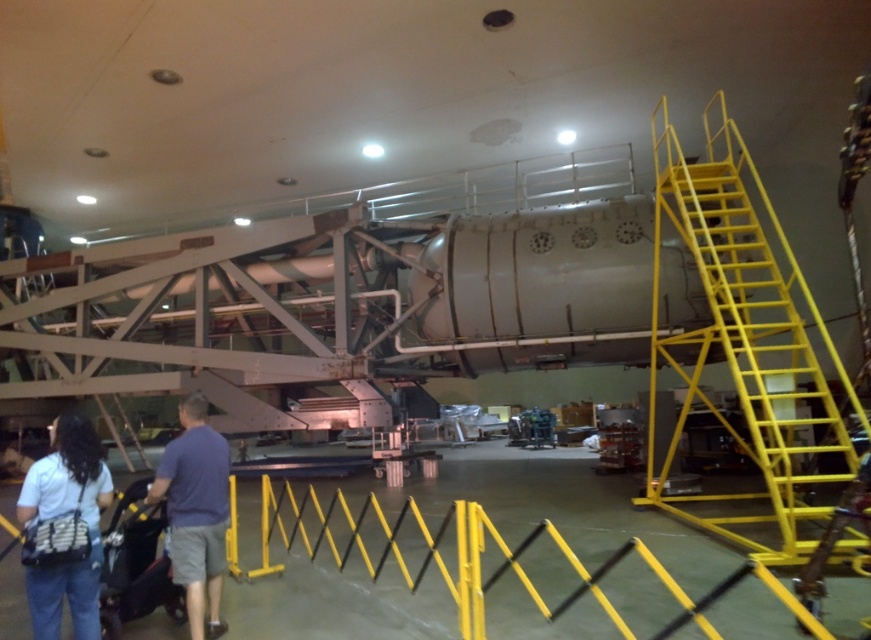
Question: Which object appears farthest from the camera in this image?

Choices:
 (A) white fabric shirt at lower left
 (B) yellow metal barrier at lower center
 (C) yellow metallic staircase at right

Answer: (C)

Question: Can you confirm if yellow metallic staircase at right is smaller than yellow metal barrier at lower center?

Choices:
 (A) yes
 (B) no

Answer: (B)

Question: Does white fabric shirt at lower left appear under blue cotton shirt at lower left?

Choices:
 (A) yes
 (B) no

Answer: (B)

Question: Is white fabric shirt at lower left below blue cotton shirt at lower left?

Choices:
 (A) no
 (B) yes

Answer: (A)

Question: Which object is positioned farthest from the yellow metal barrier at lower center?

Choices:
 (A) blue cotton shirt at lower left
 (B) white fabric shirt at lower left

Answer: (B)

Question: Which point is farther to the camera?

Choices:
 (A) yellow metallic staircase at right
 (B) yellow metal barrier at lower center
 (C) white fabric shirt at lower left

Answer: (A)